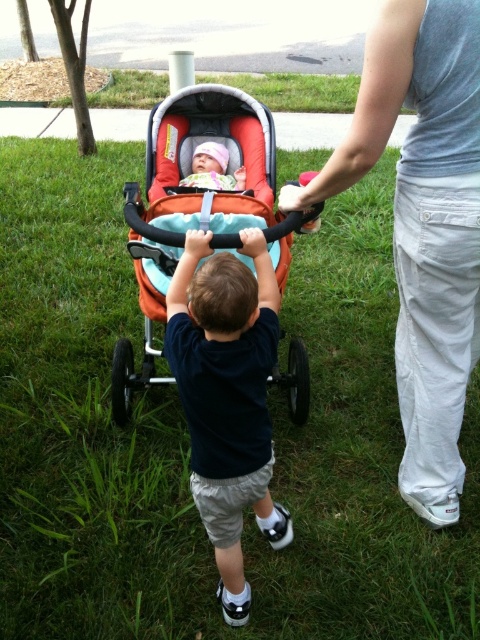
Is gray cotton shirt at upper right to the left of dark blue shirt at center from the viewer's perspective?

In fact, gray cotton shirt at upper right is to the right of dark blue shirt at center.

Between point (456, 321) and point (247, 460), which one is positioned in front?

Point (247, 460) is in front.

Is point (280, 193) positioned before point (228, 518)?

That is False.

Locate an element on the screen. The height and width of the screenshot is (640, 480). gray cotton shirt at upper right is located at coordinates (423, 225).

Does gray cotton shirt at upper right come behind orange fabric baby carriage at center?

That is False.

Which is behind, point (424, 182) or point (252, 157)?

Positioned behind is point (252, 157).

Between point (371, 60) and point (136, 257), which one is positioned in front?

Point (371, 60) is more forward.

You are a GUI agent. You are given a task and a screenshot of the screen. Output one action in this format:
    pyautogui.click(x=<x>, y=<y>)
    Task: Click on the gray cotton shirt at upper right
    This screenshot has width=480, height=640.
    Given the screenshot: What is the action you would take?
    pyautogui.click(x=423, y=225)

Which is more to the left, dark blue shirt at center or matte pink hat at center?

From the viewer's perspective, matte pink hat at center appears more on the left side.

Does dark blue shirt at center appear under matte pink hat at center?

Indeed, dark blue shirt at center is positioned under matte pink hat at center.

Is point (242, 278) less distant than point (203, 170)?

Yes, it is.

Find the location of a particular element. The height and width of the screenshot is (640, 480). dark blue shirt at center is located at coordinates (227, 396).